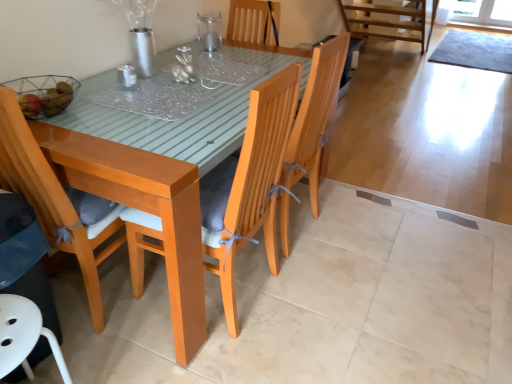
The image size is (512, 384). In order to click on free space in front of metallic silver candlestick at center, which is counted as the 1th tableware, starting from the bottom in this screenshot , I will do `click(117, 102)`.